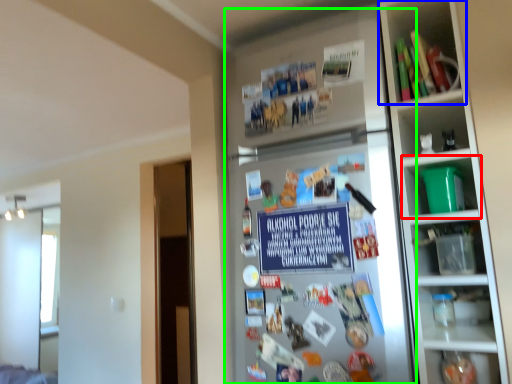
Question: Which object is positioned closest to shelf (highlighted by a red box)? Select from shelf (highlighted by a blue box) and fridge (highlighted by a green box).

Choices:
 (A) shelf
 (B) fridge

Answer: (B)